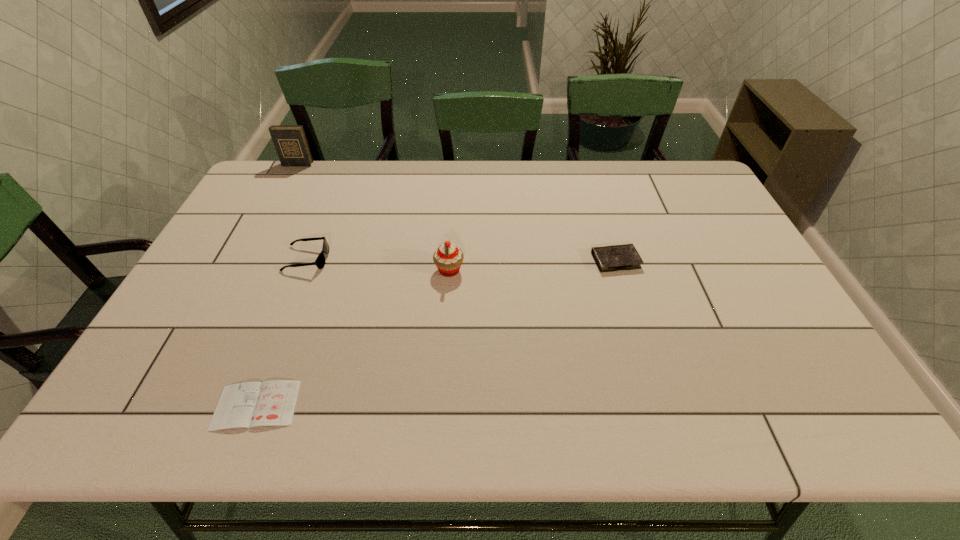
Where is `vacant area in the image that satisfies the following two spatial constraints: 1. on the front cover of the second nearest diary; 2. on the right side of the leftmost object`? The image size is (960, 540). vacant area in the image that satisfies the following two spatial constraints: 1. on the front cover of the second nearest diary; 2. on the right side of the leftmost object is located at coordinates (246, 260).

Find the location of a particular element. Image resolution: width=960 pixels, height=540 pixels. vacant space that satisfies the following two spatial constraints: 1. on the front cover of the second shortest diary; 2. on the left side of the leftmost object is located at coordinates (246, 260).

Find the location of a particular element. The width and height of the screenshot is (960, 540). vacant space that satisfies the following two spatial constraints: 1. on the front cover of the rightmost object; 2. on the left side of the farthest diary is located at coordinates (246, 260).

This screenshot has width=960, height=540. Identify the location of vacant space that satisfies the following two spatial constraints: 1. on the front-facing side of the third shortest object; 2. on the left side of the fourth shortest object. (302, 270).

This screenshot has width=960, height=540. In order to click on blank area in the image that satisfies the following two spatial constraints: 1. on the front-facing side of the third shortest object; 2. on the right side of the cupcake in this screenshot , I will do pyautogui.click(x=302, y=270).

At what (x,y) coordinates should I click in order to perform the action: click on free space that satisfies the following two spatial constraints: 1. on the front cover of the farthest diary; 2. on the right side of the second shortest diary. Please return your answer as a coordinate pair (x, y). The width and height of the screenshot is (960, 540). Looking at the image, I should click on (246, 260).

The width and height of the screenshot is (960, 540). I want to click on vacant position in the image that satisfies the following two spatial constraints: 1. on the front cover of the tallest object; 2. on the left side of the cupcake, so click(241, 270).